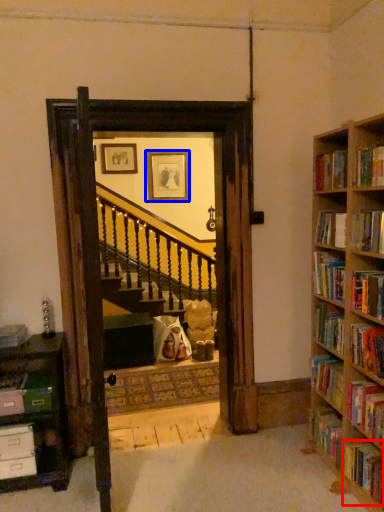
Question: Among these objects, which one is farthest to the camera, book (highlighted by a red box) or picture frame (highlighted by a blue box)?

Choices:
 (A) book
 (B) picture frame

Answer: (B)